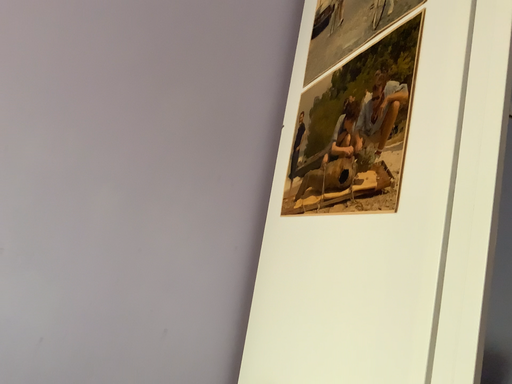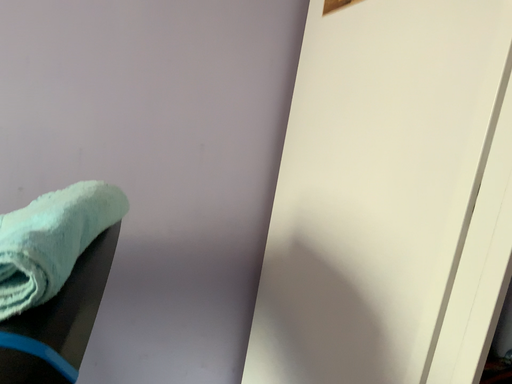
Question: How did the camera likely rotate when shooting the video?

Choices:
 (A) rotated downward
 (B) rotated upward

Answer: (A)